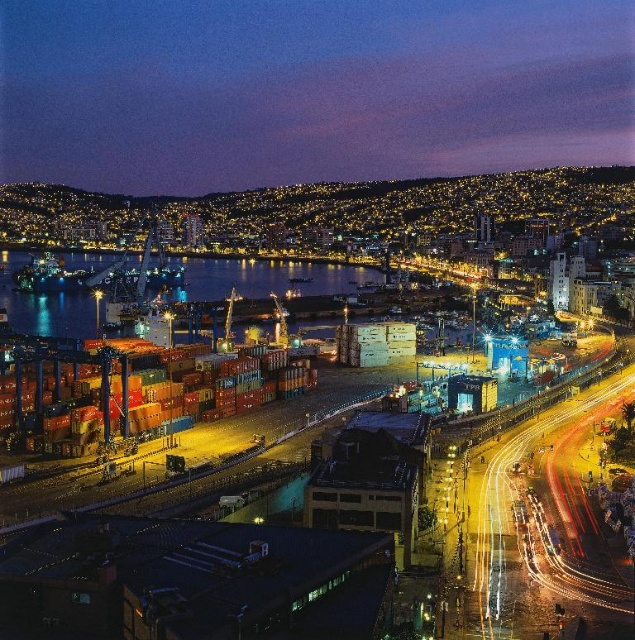
You are a delivery driver who needs to cross the dark blue water at center to reach the metallic containers at center. Is there a bridge or a path available for you to drive across?

The metallic containers at center is positioned under dark blue water at center, which means the containers are submerged underwater. Therefore, there is no bridge or path available for you to drive across to reach them.